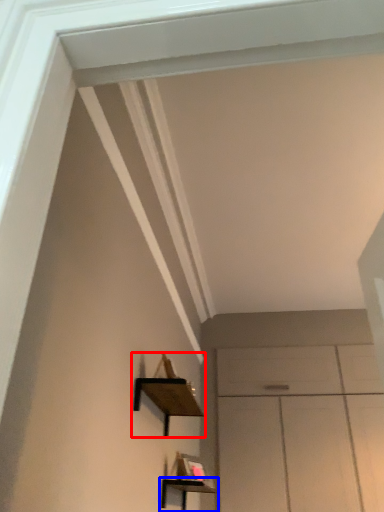
Question: Which object appears closest to the camera in this image, shelf (highlighted by a red box) or shelf (highlighted by a blue box)?

Choices:
 (A) shelf
 (B) shelf

Answer: (A)